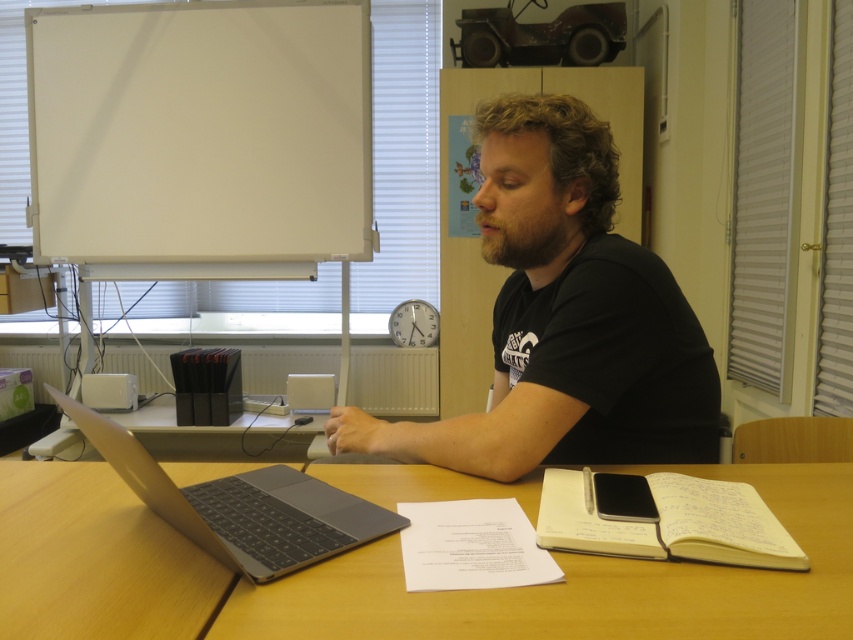
Question: Does black matte shirt at center have a lesser width compared to white matte board at upper left?

Choices:
 (A) yes
 (B) no

Answer: (A)

Question: Which point is closer to the camera?

Choices:
 (A) black matte shirt at center
 (B) white matte board at upper left

Answer: (A)

Question: Which object is positioned closest to the black matte shirt at center?

Choices:
 (A) silver metallic laptop at center
 (B) white matte board at upper left
 (C) wooden table at center

Answer: (C)

Question: Is white matte board at upper left above silver metallic laptop at center?

Choices:
 (A) yes
 (B) no

Answer: (A)

Question: Which point appears farthest from the camera in this image?

Choices:
 (A) (769, 496)
 (B) (546, 397)

Answer: (B)

Question: Can you confirm if wooden table at center is smaller than silver metallic laptop at center?

Choices:
 (A) yes
 (B) no

Answer: (B)